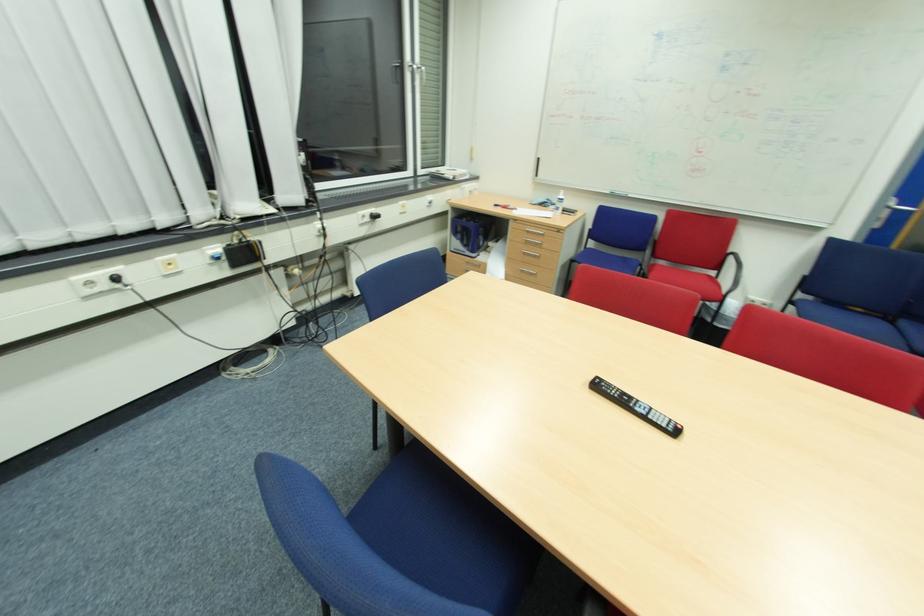
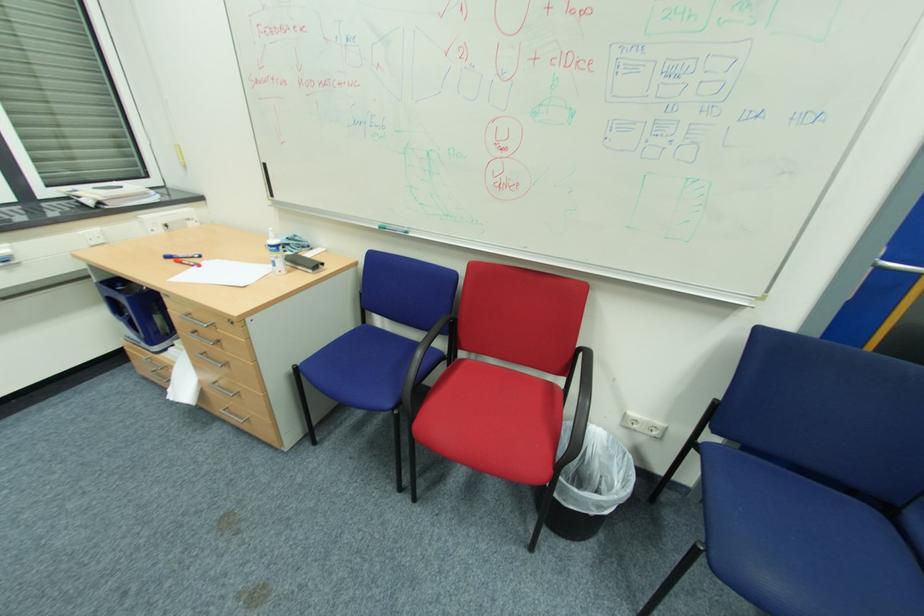
The images are taken continuously from a first-person perspective. In which direction are you moving?

The movement direction of the cameraman is right, forward.